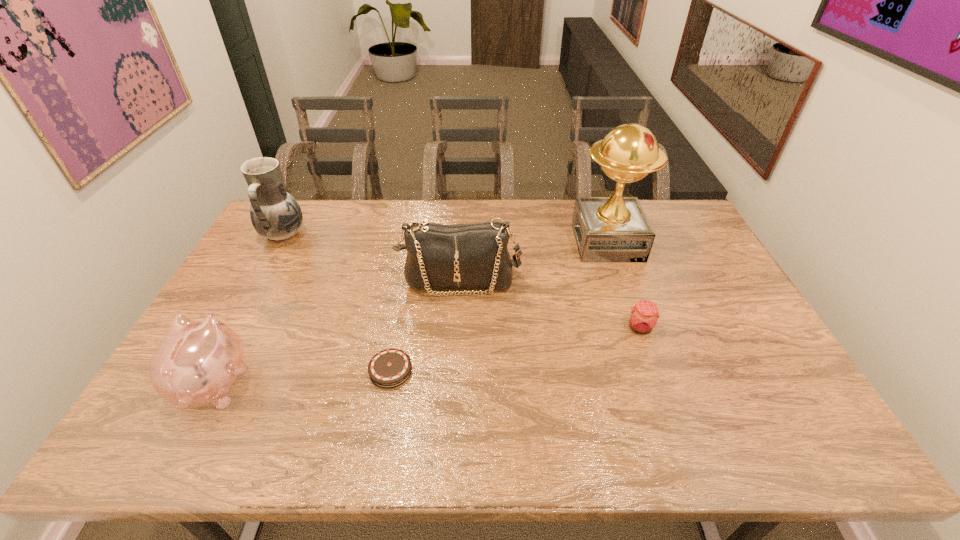
The height and width of the screenshot is (540, 960). In order to click on free location at the near right corner in this screenshot , I will do `click(805, 426)`.

The image size is (960, 540). I want to click on vacant space that is in between the tallest object and the shortest object, so click(x=499, y=307).

Where is `free space between the fourth shortest object and the shortest object`? free space between the fourth shortest object and the shortest object is located at coordinates (425, 326).

This screenshot has width=960, height=540. What are the coordinates of `unoccupied position between the tallest object and the third shortest object` in the screenshot? It's located at (411, 312).

I want to click on vacant area that lies between the fifth tallest object and the piggy bank, so click(x=427, y=355).

The height and width of the screenshot is (540, 960). Identify the location of unoccupied position between the fourth tallest object and the award. (411, 312).

Locate an element on the screen. The image size is (960, 540). vacant area that lies between the shortest object and the pitcher is located at coordinates (337, 303).

Where is `free space between the shortest object and the award`? free space between the shortest object and the award is located at coordinates (499, 307).

This screenshot has width=960, height=540. What are the coordinates of `vacant area that lies between the handbag and the fourth tallest object` in the screenshot? It's located at pyautogui.click(x=337, y=332).

Locate an element on the screen. vacant space that's between the fourth tallest object and the chocolate cake is located at coordinates (303, 376).